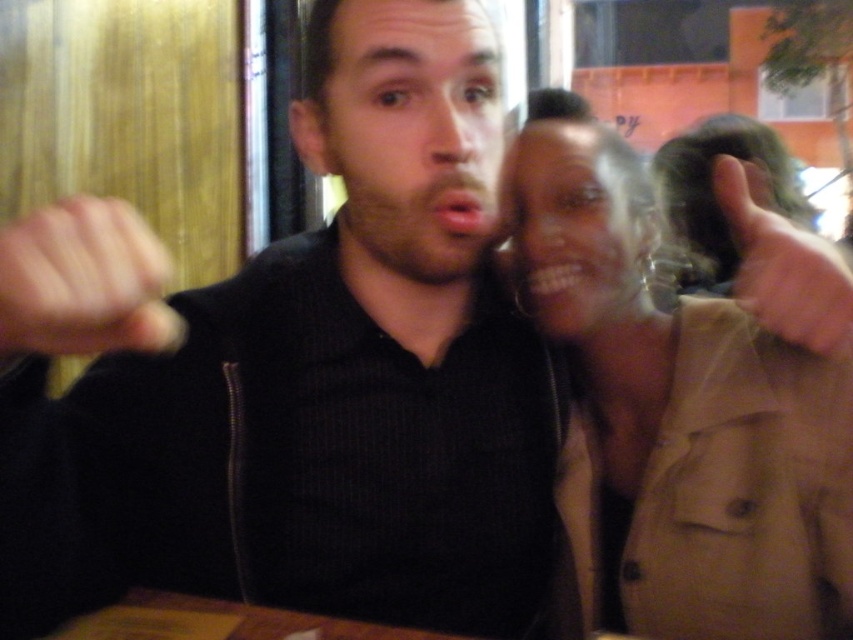
Based on the photo, you are a photographer who needs to adjust the lighting to ensure both the tan fabric jacket at upper right and the beardsoftface at center are well lit. Which object should you focus the light on first to ensure proper exposure?

The tan fabric jacket at upper right is positioned under beardsoftface at center, so focusing the light on the beardsoftface at center first would ensure it receives adequate illumination before adjusting for the jacket below.

You are a photographer at a social event and notice two people posing. You see the matte skin face at upper right and the skinny beige hand at upper right. Which one appears larger in the photo?

The skinny beige hand at upper right appears larger than the matte skin face at upper right because the description states that the matte skin face is smaller than the skinny beige hand.

You are a photographer trying to adjust the lighting in the scene. You notice the black matte shirt at center and the matte black fist at center. Which object is positioned lower in the image?

The black matte shirt at center is below the matte black fist at center, so the black matte shirt at center is positioned lower in the image.